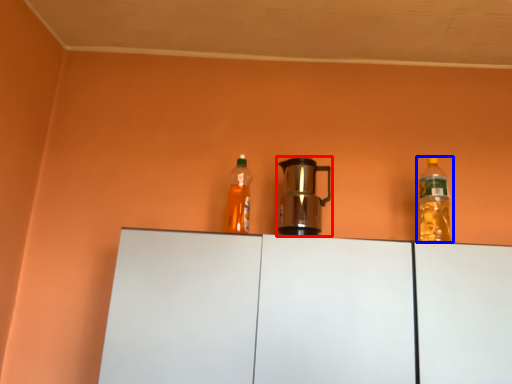
Question: Which object appears closest to the camera in this image, kitchen appliance (highlighted by a red box) or bottle (highlighted by a blue box)?

Choices:
 (A) kitchen appliance
 (B) bottle

Answer: (A)